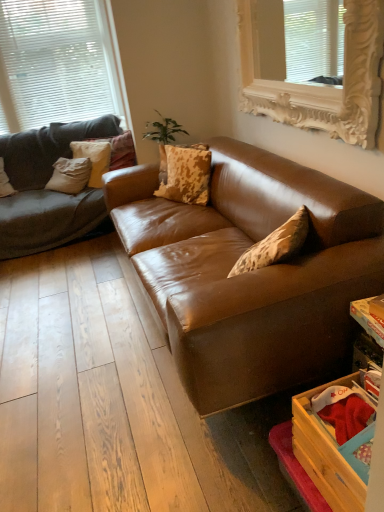
Question: Does leopard print fabric pillow at center, which is counted as the 1th pillow, starting from the right, have a lesser height compared to brown leather couch at center?

Choices:
 (A) yes
 (B) no

Answer: (A)

Question: From the image's perspective, is leopard print fabric pillow at center, which is counted as the 1th pillow, starting from the right, under brown leather couch at center?

Choices:
 (A) yes
 (B) no

Answer: (B)

Question: From the image's perspective, is leopard print fabric pillow at center, which is counted as the 1th pillow, starting from the right, above brown leather couch at center?

Choices:
 (A) yes
 (B) no

Answer: (A)

Question: Is there a large distance between leopard print fabric pillow at center, marked as the 4th pillow in a left-to-right arrangement, and brown leather couch at center?

Choices:
 (A) no
 (B) yes

Answer: (A)

Question: Does leopard print fabric pillow at center, which is counted as the 1th pillow, starting from the right, appear on the right side of brown leather couch at center?

Choices:
 (A) yes
 (B) no

Answer: (B)

Question: Considering the relative sizes of leopard print fabric pillow at center, which is counted as the 1th pillow, starting from the right, and brown leather couch at center in the image provided, is leopard print fabric pillow at center, which is counted as the 1th pillow, starting from the right, thinner than brown leather couch at center?

Choices:
 (A) yes
 (B) no

Answer: (A)

Question: Considering the relative sizes of matte gray pillow at left, which ranks as the first pillow in left-to-right order, and white ornate frame at upper center, which ranks as the first window in right-to-left order, in the image provided, is matte gray pillow at left, which ranks as the first pillow in left-to-right order, smaller than white ornate frame at upper center, which ranks as the first window in right-to-left order,?

Choices:
 (A) yes
 (B) no

Answer: (A)

Question: Is matte gray pillow at left, which ranks as the first pillow in left-to-right order, located outside white ornate frame at upper center, marked as the 2th window in a back-to-front arrangement?

Choices:
 (A) no
 (B) yes

Answer: (B)

Question: Is matte gray pillow at left, the fourth pillow when ordered from right to left, shorter than white ornate frame at upper center, which ranks as the first window in right-to-left order?

Choices:
 (A) yes
 (B) no

Answer: (A)

Question: Is matte gray pillow at left, which ranks as the first pillow in left-to-right order, at the right side of white ornate frame at upper center, which ranks as the first window in right-to-left order?

Choices:
 (A) no
 (B) yes

Answer: (A)

Question: From a real-world perspective, does matte gray pillow at left, which ranks as the first pillow in left-to-right order, sit lower than white ornate frame at upper center, positioned as the first window in front-to-back order?

Choices:
 (A) no
 (B) yes

Answer: (B)

Question: Considering the relative positions of matte gray pillow at left, the fourth pillow when ordered from right to left, and white ornate frame at upper center, which ranks as the 2th window in left-to-right order, in the image provided, is matte gray pillow at left, the fourth pillow when ordered from right to left, to the left of white ornate frame at upper center, which ranks as the 2th window in left-to-right order, from the viewer's perspective?

Choices:
 (A) no
 (B) yes

Answer: (B)

Question: Considering the relative positions of textured beige pillow at left, marked as the second pillow in a left-to-right arrangement, and matte gray pillow at left, the fourth pillow when ordered from right to left, in the image provided, is textured beige pillow at left, marked as the second pillow in a left-to-right arrangement, to the right of matte gray pillow at left, the fourth pillow when ordered from right to left, from the viewer's perspective?

Choices:
 (A) no
 (B) yes

Answer: (B)